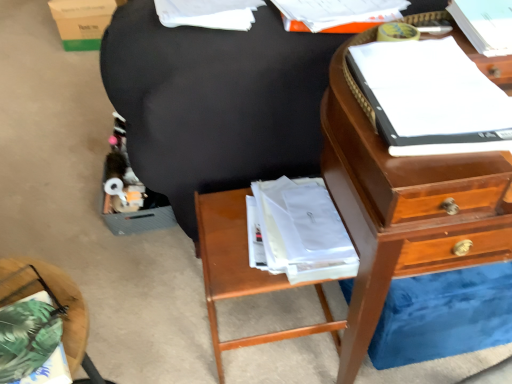
The image size is (512, 384). Describe the element at coordinates (82, 21) in the screenshot. I see `green cardboard box at upper left` at that location.

Locate an element on the screen. The height and width of the screenshot is (384, 512). white paper at upper right, which is the second book in right-to-left order is located at coordinates (432, 98).

In order to face white paper at upper right, marked as the 1th book in a right-to-left arrangement, should I rotate leftwards or rightwards?

Rotate your view right by about 32.225°.

The width and height of the screenshot is (512, 384). What do you see at coordinates (55, 303) in the screenshot? I see `green fabric pillow at lower left, the first nightstand from the front` at bounding box center [55, 303].

Find the location of a particular element. The width and height of the screenshot is (512, 384). green fabric pillow at lower left, the first nightstand from the front is located at coordinates (55, 303).

Identify the location of black fabric bean bag chair at center. (215, 102).

Would you say white paper at upper center, the third book in the right-to-left sequence, is inside or outside black fabric bean bag chair at center?

white paper at upper center, the third book in the right-to-left sequence, is inside black fabric bean bag chair at center.

Can you confirm if white paper at upper center, marked as the first book in a left-to-right arrangement, is wider than black fabric bean bag chair at center?

In fact, white paper at upper center, marked as the first book in a left-to-right arrangement, might be narrower than black fabric bean bag chair at center.

Is point (179, 22) positioned in front of point (139, 117)?

That is True.

The image size is (512, 384). I want to click on the 1st nightstand to the left when counting from the white paper at upper right, which is counted as the 3th book, starting from the left, so click(x=242, y=271).

Who is taller, white paper at upper right, marked as the 1th book in a right-to-left arrangement, or wooden nightstand at lower center, positioned as the first nightstand in back-to-front order?

With more height is wooden nightstand at lower center, positioned as the first nightstand in back-to-front order.

Which object is positioned more to the left, white paper at upper right, marked as the 1th book in a right-to-left arrangement, or wooden nightstand at lower center, positioned as the first nightstand in back-to-front order?

wooden nightstand at lower center, positioned as the first nightstand in back-to-front order, is more to the left.

Is point (502, 39) positioned before point (213, 223)?

That is True.

Which is closer to the camera, [405,85] or [460,2]?

Point [405,85] is closer to the camera than point [460,2].

Is white paper at upper right, marked as the 2th book in a left-to-right arrangement, with white paper at upper right, marked as the 1th book in a right-to-left arrangement?

No, white paper at upper right, marked as the 2th book in a left-to-right arrangement, is not with white paper at upper right, marked as the 1th book in a right-to-left arrangement.

Identify the location of the 1st book to the left when counting from the white paper at upper right, which is counted as the 3th book, starting from the left. The height and width of the screenshot is (384, 512). click(432, 98).

Is white paper at upper right, marked as the 2th book in a left-to-right arrangement, positioned with its back to white paper at upper right, which is counted as the 3th book, starting from the left?

white paper at upper right, marked as the 2th book in a left-to-right arrangement, is not turned away from white paper at upper right, which is counted as the 3th book, starting from the left.

Is point (4, 270) positioned behind point (481, 42)?

That is False.

In the image, is green fabric pillow at lower left, the second nightstand in the right-to-left sequence, positioned in front of or behind white paper at upper right, marked as the 1th book in a right-to-left arrangement?

green fabric pillow at lower left, the second nightstand in the right-to-left sequence, is positioned closer to the viewer than white paper at upper right, marked as the 1th book in a right-to-left arrangement.

From a real-world perspective, is green fabric pillow at lower left, the first nightstand from the front, positioned under white paper at upper right, which is counted as the 3th book, starting from the left, based on gravity?

Indeed, from a real-world perspective, green fabric pillow at lower left, the first nightstand from the front, is positioned beneath white paper at upper right, which is counted as the 3th book, starting from the left.

Considering the relative positions of green fabric pillow at lower left, the second nightstand in the right-to-left sequence, and white paper at upper right, marked as the 1th book in a right-to-left arrangement, in the image provided, is green fabric pillow at lower left, the second nightstand in the right-to-left sequence, to the left of white paper at upper right, marked as the 1th book in a right-to-left arrangement, from the viewer's perspective?

Yes, green fabric pillow at lower left, the second nightstand in the right-to-left sequence, is to the left of white paper at upper right, marked as the 1th book in a right-to-left arrangement.

Is green fabric pillow at lower left, which appears as the 2th nightstand when viewed from the back, inside the boundaries of wooden nightstand at lower center, positioned as the first nightstand in back-to-front order, or outside?

green fabric pillow at lower left, which appears as the 2th nightstand when viewed from the back, lies outside wooden nightstand at lower center, positioned as the first nightstand in back-to-front order.

From the image's perspective, relative to wooden nightstand at lower center, which ranks as the second nightstand in left-to-right order, is green fabric pillow at lower left, the first nightstand when ordered from left to right, above or below?

From the image's perspective, green fabric pillow at lower left, the first nightstand when ordered from left to right, appears below wooden nightstand at lower center, which ranks as the second nightstand in left-to-right order.

Looking at this image, is green fabric pillow at lower left, the first nightstand from the front, facing towards wooden nightstand at lower center, positioned as the first nightstand in back-to-front order?

No, green fabric pillow at lower left, the first nightstand from the front, is not turned towards wooden nightstand at lower center, positioned as the first nightstand in back-to-front order.

Find the location of a particular element. The width and height of the screenshot is (512, 384). nightstand above the wooden nightstand at lower center, which ranks as the second nightstand in left-to-right order (from a real-world perspective) is located at coordinates (55, 303).

From the image's perspective, is wooden nightstand at lower center, positioned as the first nightstand in back-to-front order, on top of green fabric pillow at lower left, which appears as the 2th nightstand when viewed from the back?

Indeed, from the image's perspective, wooden nightstand at lower center, positioned as the first nightstand in back-to-front order, is shown above green fabric pillow at lower left, which appears as the 2th nightstand when viewed from the back.

Consider the image. Is wooden nightstand at lower center, which is the second nightstand from front to back, located outside green fabric pillow at lower left, the first nightstand when ordered from left to right?

Yes, wooden nightstand at lower center, which is the second nightstand from front to back, is outside of green fabric pillow at lower left, the first nightstand when ordered from left to right.

From a real-world perspective, which object stands above the other?

green fabric pillow at lower left, which appears as the 2th nightstand when viewed from the back.

Is black fabric bean bag chair at center taller or shorter than white paper at upper right, which is the second book in right-to-left order?

black fabric bean bag chair at center is taller than white paper at upper right, which is the second book in right-to-left order.

Would you say black fabric bean bag chair at center contains white paper at upper right, marked as the 2th book in a left-to-right arrangement?

That's incorrect, white paper at upper right, marked as the 2th book in a left-to-right arrangement, is not inside black fabric bean bag chair at center.

Identify the location of the 2nd book to the left when counting from the black fabric bean bag chair at center. (208, 13).

Locate an element on the screen. the 2nd book counting from the right side of the wooden nightstand at lower center, which ranks as the second nightstand in left-to-right order is located at coordinates (485, 24).

Estimate the real-world distances between objects in this image. Which object is further from wooden nightstand at lower center, positioned as the first nightstand in back-to-front order, white paper at upper center, the third book in the right-to-left sequence, or black fabric bean bag chair at center?

white paper at upper center, the third book in the right-to-left sequence, is positioned further to the anchor wooden nightstand at lower center, positioned as the first nightstand in back-to-front order.

From the image, which object appears to be nearer to wooden nightstand at lower center, which ranks as the second nightstand in left-to-right order, black fabric bean bag chair at center or white paper at upper right, which is counted as the 3th book, starting from the left?

Among the two, black fabric bean bag chair at center is located nearer to wooden nightstand at lower center, which ranks as the second nightstand in left-to-right order.

Based on their spatial positions, is black fabric bean bag chair at center or wooden nightstand at lower center, which ranks as the second nightstand in left-to-right order, closer to white paper at upper center, marked as the first book in a left-to-right arrangement?

black fabric bean bag chair at center.

When comparing their distances from white paper at upper right, which is counted as the 3th book, starting from the left, does black fabric bean bag chair at center or wooden nightstand at lower center, which ranks as the second nightstand in left-to-right order, seem further?

wooden nightstand at lower center, which ranks as the second nightstand in left-to-right order.

From the image, which object appears to be farther from white paper at upper right, which is the second book in right-to-left order, wooden nightstand at lower center, positioned as the first nightstand in back-to-front order, or black fabric bean bag chair at center?

wooden nightstand at lower center, positioned as the first nightstand in back-to-front order.

Which object lies further to the anchor point white paper at upper right, marked as the 1th book in a right-to-left arrangement, white paper at upper center, marked as the first book in a left-to-right arrangement, or green cardboard box at upper left?

Among the two, green cardboard box at upper left is located further to white paper at upper right, marked as the 1th book in a right-to-left arrangement.

Based on their spatial positions, is white paper at upper center, marked as the first book in a left-to-right arrangement, or wooden nightstand at lower center, which ranks as the second nightstand in left-to-right order, further from black fabric bean bag chair at center?

Among the two, wooden nightstand at lower center, which ranks as the second nightstand in left-to-right order, is located further to black fabric bean bag chair at center.

Looking at the image, which one is located closer to black fabric bean bag chair at center, white paper at upper right, marked as the 2th book in a left-to-right arrangement, or wooden nightstand at lower center, positioned as the first nightstand in back-to-front order?

The object closer to black fabric bean bag chair at center is wooden nightstand at lower center, positioned as the first nightstand in back-to-front order.

Find the location of a particular element. The width and height of the screenshot is (512, 384). nightstand between white paper at upper right, which is counted as the 3th book, starting from the left, and green cardboard box at upper left from front to back is located at coordinates (242, 271).

Where is `nightstand that lies between white paper at upper center, marked as the first book in a left-to-right arrangement, and green fabric pillow at lower left, the first nightstand from the front, from top to bottom`? nightstand that lies between white paper at upper center, marked as the first book in a left-to-right arrangement, and green fabric pillow at lower left, the first nightstand from the front, from top to bottom is located at coordinates (242, 271).

Image resolution: width=512 pixels, height=384 pixels. Find the location of `bean bag chair between green fabric pillow at lower left, the first nightstand from the front, and white paper at upper right, marked as the 1th book in a right-to-left arrangement, in the horizontal direction`. bean bag chair between green fabric pillow at lower left, the first nightstand from the front, and white paper at upper right, marked as the 1th book in a right-to-left arrangement, in the horizontal direction is located at coordinates (215, 102).

At what (x,y) coordinates should I click in order to perform the action: click on nightstand located between green fabric pillow at lower left, the first nightstand when ordered from left to right, and white paper at upper right, marked as the 2th book in a left-to-right arrangement, in the left-right direction. Please return your answer as a coordinate pair (x, y). The width and height of the screenshot is (512, 384). Looking at the image, I should click on (242, 271).